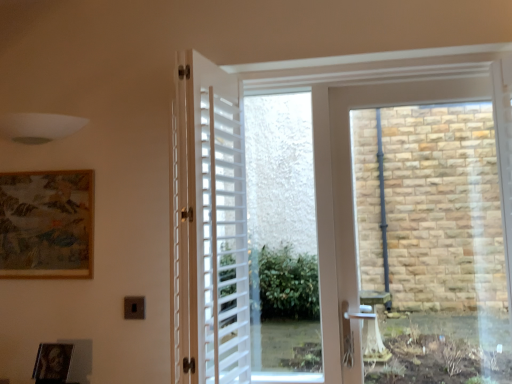
Question: From a real-world perspective, is wooden textured picture frame at upper left, which is the first picture frame in back-to-front order, below white matte shutter at center?

Choices:
 (A) yes
 (B) no

Answer: (B)

Question: Is wooden textured picture frame at upper left, acting as the first picture frame starting from the top, not within white matte shutter at center?

Choices:
 (A) no
 (B) yes

Answer: (B)

Question: Can you confirm if wooden textured picture frame at upper left, acting as the first picture frame starting from the top, is smaller than white matte shutter at center?

Choices:
 (A) yes
 (B) no

Answer: (A)

Question: From a real-world perspective, is wooden textured picture frame at upper left, which is the first picture frame in back-to-front order, on white matte shutter at center?

Choices:
 (A) yes
 (B) no

Answer: (A)

Question: Could you tell me if wooden textured picture frame at upper left, the second picture frame from the bottom, is turned towards white matte shutter at center?

Choices:
 (A) yes
 (B) no

Answer: (B)

Question: Is white matte shutter at center located within wooden textured picture frame at upper left, the second picture frame from the bottom?

Choices:
 (A) no
 (B) yes

Answer: (A)

Question: From a real-world perspective, is wooden textured picture frame at upper left, acting as the first picture frame starting from the top, positioned under black matte picture frame at lower left, the second picture frame viewed from the top, based on gravity?

Choices:
 (A) no
 (B) yes

Answer: (A)

Question: Are wooden textured picture frame at upper left, the second picture frame from the front, and black matte picture frame at lower left, the 1th picture frame from the front, far apart?

Choices:
 (A) yes
 (B) no

Answer: (B)

Question: Does wooden textured picture frame at upper left, acting as the first picture frame starting from the top, have a lesser width compared to black matte picture frame at lower left, the second picture frame viewed from the top?

Choices:
 (A) no
 (B) yes

Answer: (B)

Question: Can you confirm if wooden textured picture frame at upper left, acting as the first picture frame starting from the top, is positioned to the left of black matte picture frame at lower left, the 1th picture frame from the front?

Choices:
 (A) no
 (B) yes

Answer: (B)

Question: Is black matte picture frame at lower left, the 1th picture frame ordered from the bottom, surrounded by wooden textured picture frame at upper left, which is the first picture frame in back-to-front order?

Choices:
 (A) yes
 (B) no

Answer: (B)

Question: From the image's perspective, is wooden textured picture frame at upper left, which is the first picture frame in back-to-front order, beneath black matte picture frame at lower left, the second picture frame viewed from the top?

Choices:
 (A) yes
 (B) no

Answer: (B)

Question: Can you confirm if white matte shutter at center is bigger than black matte picture frame at lower left, which is the 2th picture frame in back-to-front order?

Choices:
 (A) no
 (B) yes

Answer: (B)